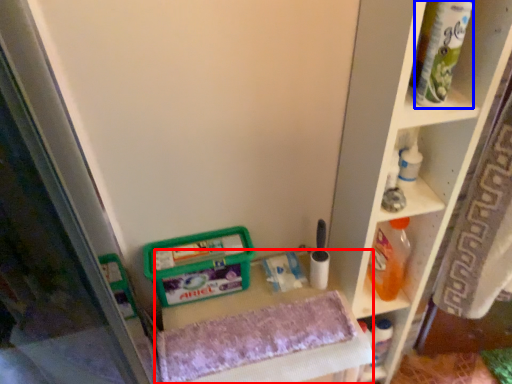
Question: Which point is further to the camera, vanity (highlighted by a red box) or tube (highlighted by a blue box)?

Choices:
 (A) vanity
 (B) tube

Answer: (A)